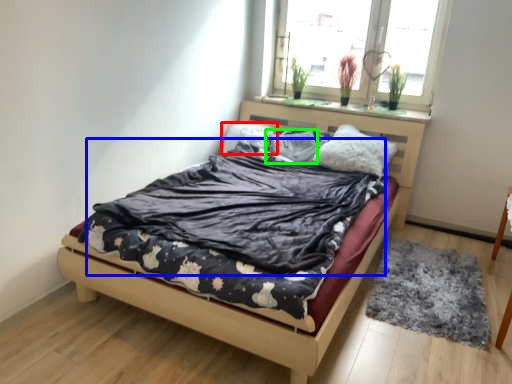
Question: Which object is positioned closest to pillow (highlighted by a red box)? Select from blanket (highlighted by a blue box) and pillow (highlighted by a green box).

Choices:
 (A) blanket
 (B) pillow

Answer: (B)